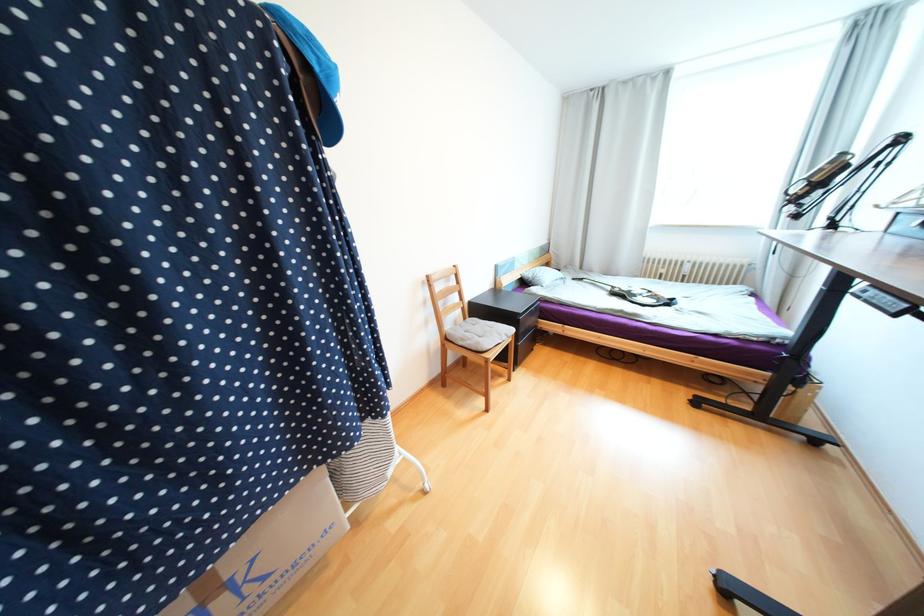
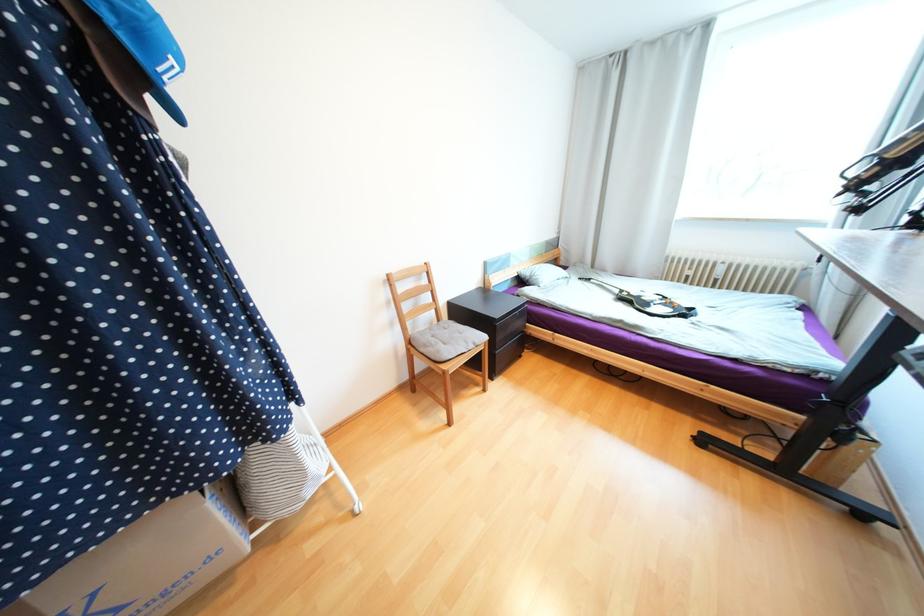
Find the pixel in the second image that matches (286,496) in the first image.

(116, 535)